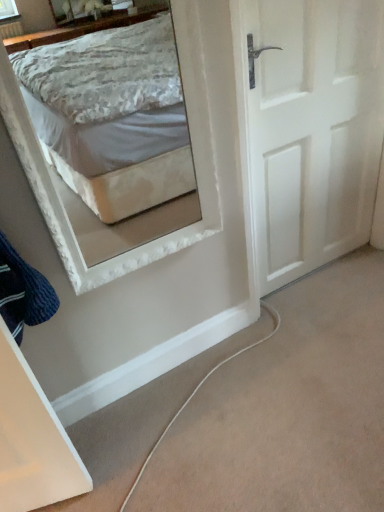
Question: Is dark blue knitted sweater at lower left spatially inside white matte door at right, or outside of it?

Choices:
 (A) outside
 (B) inside

Answer: (A)

Question: Looking at their shapes, would you say dark blue knitted sweater at lower left is wider or thinner than white matte door at right?

Choices:
 (A) thin
 (B) wide

Answer: (B)

Question: From a real-world perspective, relative to white matte door at right, is dark blue knitted sweater at lower left vertically above or below?

Choices:
 (A) below
 (B) above

Answer: (B)

Question: Considering the positions of point pyautogui.click(x=317, y=238) and point pyautogui.click(x=6, y=260), is point pyautogui.click(x=317, y=238) closer or farther from the camera than point pyautogui.click(x=6, y=260)?

Choices:
 (A) farther
 (B) closer

Answer: (A)

Question: Is white matte door at right inside the boundaries of dark blue knitted sweater at lower left, or outside?

Choices:
 (A) outside
 (B) inside

Answer: (A)

Question: Is white matte door at right taller or shorter than dark blue knitted sweater at lower left?

Choices:
 (A) short
 (B) tall

Answer: (B)

Question: Is white matte door at right wider or thinner than dark blue knitted sweater at lower left?

Choices:
 (A) thin
 (B) wide

Answer: (A)